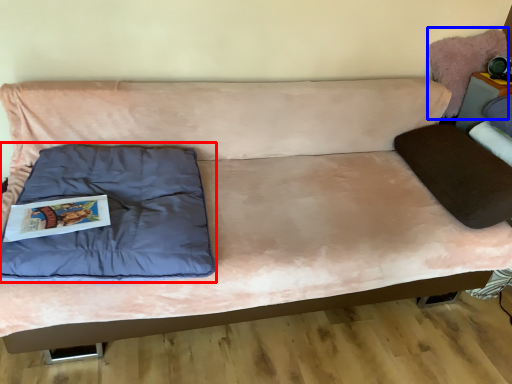
Question: Which point is further to the camera, pillow (highlighted by a red box) or swivel chair (highlighted by a blue box)?

Choices:
 (A) pillow
 (B) swivel chair

Answer: (B)